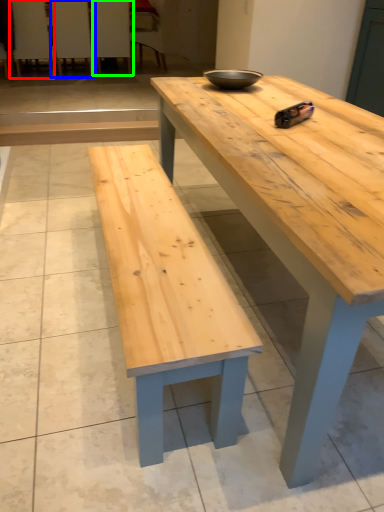
Question: Considering the real-world distances, which object is closest to chair (highlighted by a red box)? chair (highlighted by a blue box) or chair (highlighted by a green box).

Choices:
 (A) chair
 (B) chair

Answer: (A)